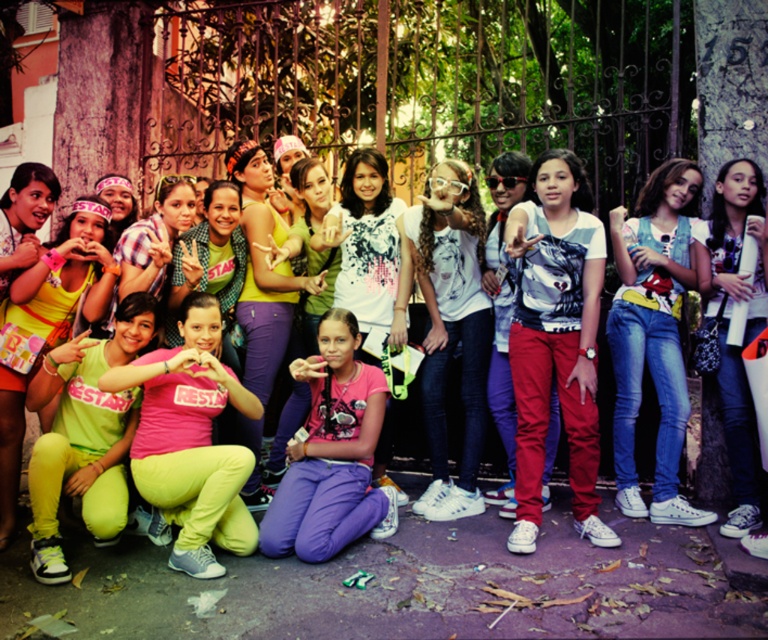
You are a photographer standing at the center of the scene. You need to capture a photo that includes both the denim jeans at right and the matte yellow pants at lower left. What is the minimum distance you must move to ensure both are in frame?

The denim jeans at right and the matte yellow pants at lower left are 4.21 meters apart. To include both in the frame, you must position yourself so that the camera can cover this distance. Assuming a standard camera angle, moving to a central point between them would require moving approximately half the distance, around 2.1 meters from each, ensuring both are within the frame.

You are a photographer trying to capture a detail shot of the denim jeans at right and the matte yellow pants at lower left. Which of the two items is positioned higher in the frame?

The denim jeans at right is located above the matte yellow pants at lower left, so it is positioned higher in the frame.

You are a photographer trying to adjust the focus of your camera. You need to focus on the denim jeans at right and the pink matte shirt at center. Which object is taller?

The denim jeans at right is taller than the pink matte shirt at center.